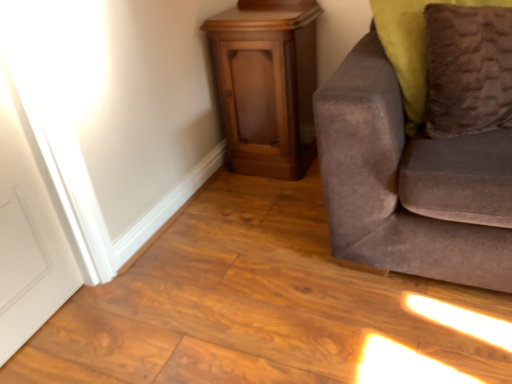
What are the coordinates of `free space in front of wooden cabinet at center` in the screenshot? It's located at tap(257, 206).